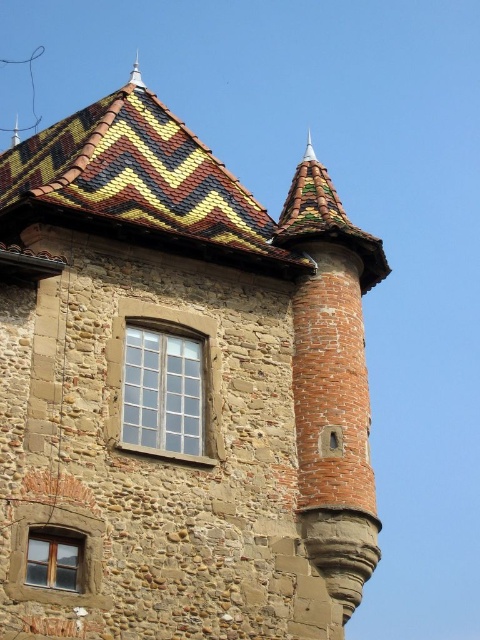
You are an architect examining the historic building. You notice the multicolored tiled roof at upper center and the wooden window at lower left. Which of these two features has a greater surface area?

The multicolored tiled roof at upper center has a larger size compared to the wooden window at lower left, so it has a greater surface area.

You are an architect examining the historic stone building. You need to determine which window, the clear glass window at center or the wooden window at lower left, has a larger area to allow more natural light into the building. Based on the description, which one would you recommend?

The clear glass window at center is bigger than the wooden window at lower left, so it allows more natural light into the building.

You are standing in front of the historic stone building and want to touch both points marked on the wall. Which point, point (57, 189) or point (156, 436), will you reach first?

Point (57, 189) is further to the camera than point (156, 436), so you will reach point (156, 436) first because it is closer to you.